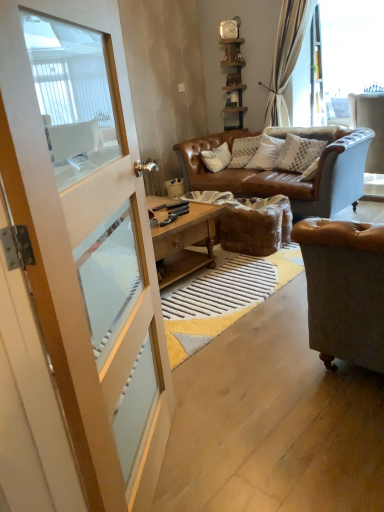
Question: Considering the positions of point (223, 35) and point (286, 142), is point (223, 35) closer or farther from the camera than point (286, 142)?

Choices:
 (A) closer
 (B) farther

Answer: (B)

Question: From the image's perspective, is metallic wall clock at upper center located above or below white textured pillow at center?

Choices:
 (A) below
 (B) above

Answer: (B)

Question: Estimate the real-world distances between objects in this image. Which object is closer to the wooden shelf at upper center?

Choices:
 (A) metallic wall clock at upper center
 (B) white textured pillow at center
 (C) white leather chair at right
 (D) brown leather footrest at center
 (E) white wood screen door at left

Answer: (A)

Question: Considering the real-world distances, which object is farthest from the white leather chair at right?

Choices:
 (A) brown leather footrest at center
 (B) metallic wall clock at upper center
 (C) white wood screen door at left
 (D) transparent glass window at upper right
 (E) white textured pillow at center

Answer: (C)